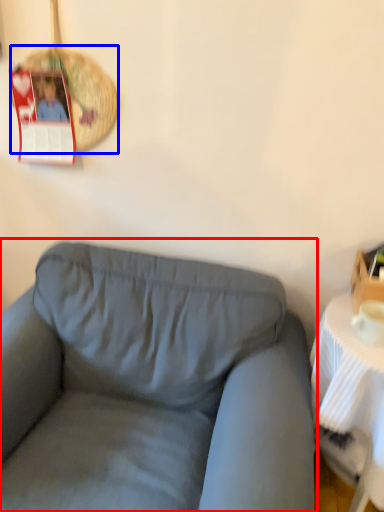
Question: Among these objects, which one is nearest to the camera, studio couch (highlighted by a red box) or basket (highlighted by a blue box)?

Choices:
 (A) studio couch
 (B) basket

Answer: (A)